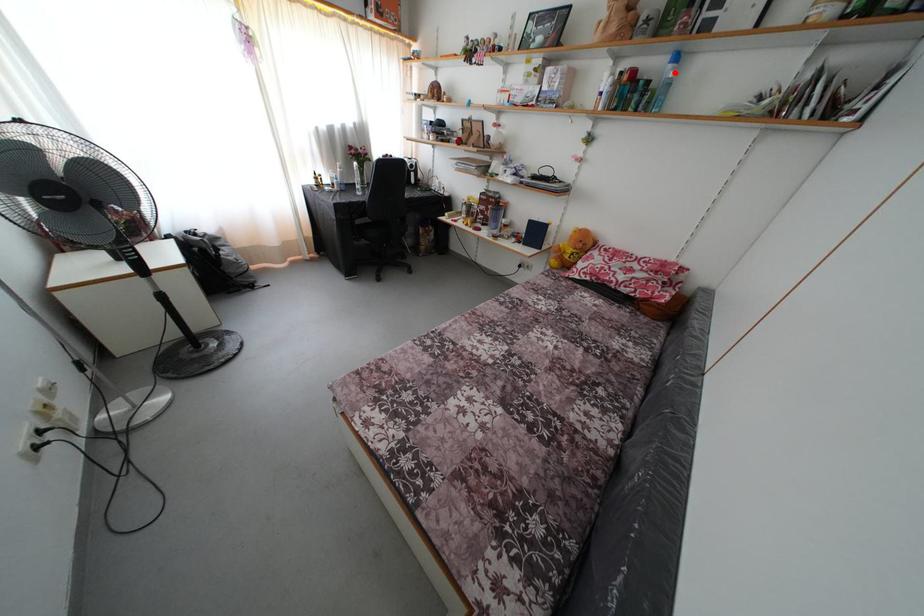
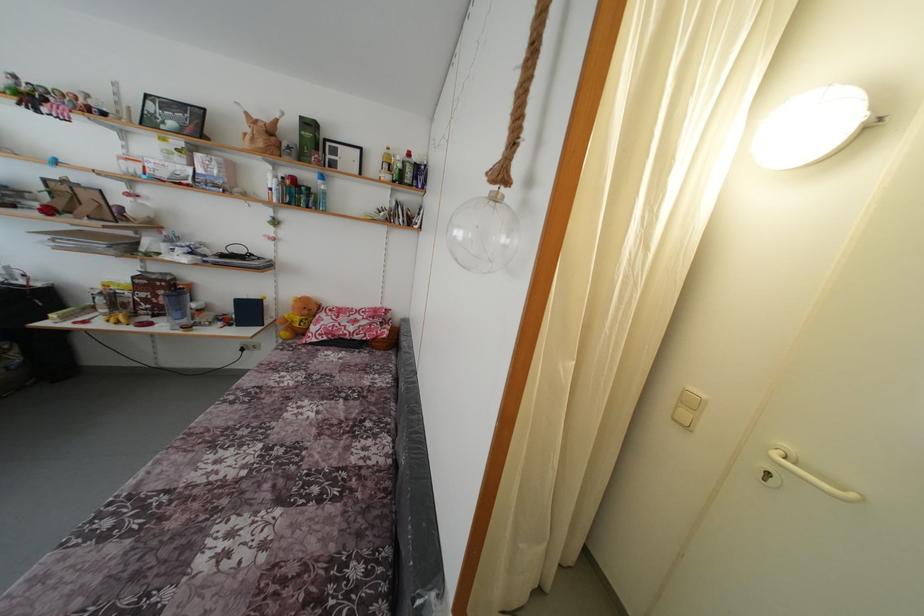
Question: I am providing you with two images of the same scene from different viewpoints. In image1, a red point is highlighted. Considering the same 3D point in image2, which of the following is correct?

Choices:
 (A) It is closer
 (B) It is farther

Answer: (A)